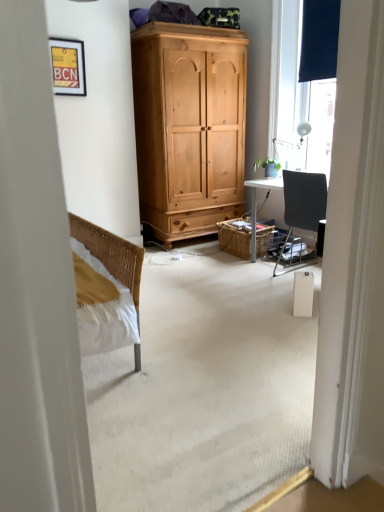
Question: Is green matte plant at right further to the viewer compared to matte yellow picture frame at upper left?

Choices:
 (A) yes
 (B) no

Answer: (A)

Question: Is green matte plant at right bigger than matte yellow picture frame at upper left?

Choices:
 (A) no
 (B) yes

Answer: (B)

Question: Does green matte plant at right appear on the left side of matte yellow picture frame at upper left?

Choices:
 (A) no
 (B) yes

Answer: (A)

Question: From a real-world perspective, does green matte plant at right sit lower than matte yellow picture frame at upper left?

Choices:
 (A) no
 (B) yes

Answer: (B)

Question: From the image's perspective, is green matte plant at right located above matte yellow picture frame at upper left?

Choices:
 (A) no
 (B) yes

Answer: (A)

Question: Considering their positions, is woven brown picnic basket at center located in front of or behind green matte plant at right?

Choices:
 (A) front
 (B) behind

Answer: (B)

Question: Considering the relative positions of woven brown picnic basket at center and green matte plant at right in the image provided, is woven brown picnic basket at center to the left or to the right of green matte plant at right?

Choices:
 (A) right
 (B) left

Answer: (B)

Question: Is point (228, 252) closer or farther from the camera than point (276, 170)?

Choices:
 (A) farther
 (B) closer

Answer: (B)

Question: From the image's perspective, is woven brown picnic basket at center positioned above or below green matte plant at right?

Choices:
 (A) below
 (B) above

Answer: (A)

Question: From a real-world perspective, is matte yellow picture frame at upper left above or below green matte plant at right?

Choices:
 (A) below
 (B) above

Answer: (B)

Question: Relative to green matte plant at right, is matte yellow picture frame at upper left in front or behind?

Choices:
 (A) behind
 (B) front

Answer: (B)

Question: From the image's perspective, is matte yellow picture frame at upper left positioned above or below green matte plant at right?

Choices:
 (A) above
 (B) below

Answer: (A)

Question: Is matte yellow picture frame at upper left wider or thinner than green matte plant at right?

Choices:
 (A) wide
 (B) thin

Answer: (A)

Question: From a real-world perspective, is matte yellow picture frame at upper left positioned above or below matte black window at upper right?

Choices:
 (A) above
 (B) below

Answer: (A)

Question: Is matte yellow picture frame at upper left bigger or smaller than matte black window at upper right?

Choices:
 (A) small
 (B) big

Answer: (A)